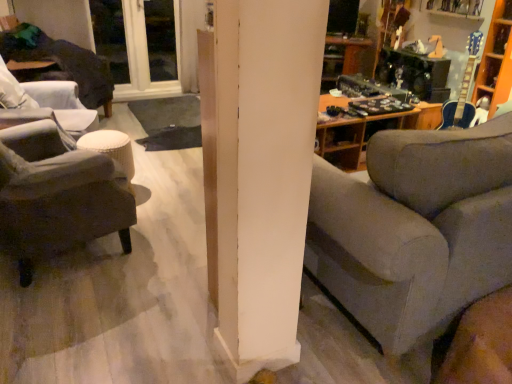
Question: Is white plastic window at upper left inside gray fabric couch at center?

Choices:
 (A) no
 (B) yes

Answer: (A)

Question: From the image's perspective, would you say gray fabric couch at center is positioned over white plastic window at upper left?

Choices:
 (A) no
 (B) yes

Answer: (A)

Question: From a real-world perspective, is gray fabric couch at center under white plastic window at upper left?

Choices:
 (A) yes
 (B) no

Answer: (A)

Question: Does gray fabric couch at center appear on the right side of white plastic window at upper left?

Choices:
 (A) no
 (B) yes

Answer: (B)

Question: Is gray fabric couch at center smaller than white plastic window at upper left?

Choices:
 (A) no
 (B) yes

Answer: (A)

Question: Can you confirm if gray fabric couch at center is shorter than white plastic window at upper left?

Choices:
 (A) yes
 (B) no

Answer: (A)

Question: From the image's perspective, is dark fabric chair at left, acting as the second chair starting from the front, on burlap-textured stool at left?

Choices:
 (A) no
 (B) yes

Answer: (B)

Question: Is dark fabric chair at left, the 1th chair viewed from the top, positioned far away from burlap-textured stool at left?

Choices:
 (A) no
 (B) yes

Answer: (A)

Question: Can you confirm if dark fabric chair at left, acting as the second chair starting from the front, is thinner than burlap-textured stool at left?

Choices:
 (A) yes
 (B) no

Answer: (B)

Question: Does dark fabric chair at left, which is the first chair in back-to-front order, lie in front of burlap-textured stool at left?

Choices:
 (A) yes
 (B) no

Answer: (B)

Question: Is dark fabric chair at left, the 1th chair viewed from the top, taller than burlap-textured stool at left?

Choices:
 (A) no
 (B) yes

Answer: (B)

Question: Is dark fabric chair at left, acting as the second chair starting from the front, placed right next to burlap-textured stool at left?

Choices:
 (A) no
 (B) yes

Answer: (A)

Question: Is dark gray fabric ottoman at left, arranged as the first chair when viewed from the front, in contact with white plastic window at upper left?

Choices:
 (A) no
 (B) yes

Answer: (A)